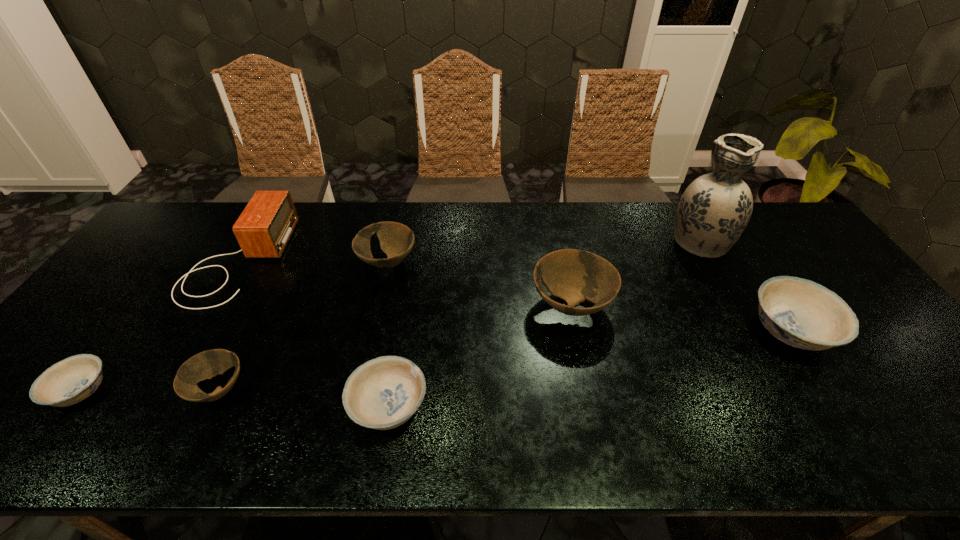
This screenshot has height=540, width=960. What are the coordinates of `the nearest brown bowl` in the screenshot? It's located at (207, 364).

I want to click on the shortest bowl, so click(x=74, y=379).

Where is `the leftmost bowl`? the leftmost bowl is located at coordinates (74, 379).

At what (x,y) coordinates should I click in order to perform the action: click on free spot located with the handle on the side of the blue vase. Please return your answer as a coordinate pair (x, y). Looking at the image, I should click on (679, 204).

Find the location of `free point located 0.310m on the front-facing side of the radio receiver`. free point located 0.310m on the front-facing side of the radio receiver is located at coordinates (382, 260).

Identify the location of vacant space located on the front of the biggest brown bowl. (594, 422).

Locate an element on the screen. vacant region located 0.140m on the left of the second brown bowl from left to right is located at coordinates (312, 263).

Where is `free location located 0.350m on the left of the biggest blue bowl`? The width and height of the screenshot is (960, 540). free location located 0.350m on the left of the biggest blue bowl is located at coordinates (613, 330).

The height and width of the screenshot is (540, 960). I want to click on free space located 0.280m on the left of the second blue bowl from left to right, so click(x=225, y=407).

The image size is (960, 540). I want to click on vacant space located 0.340m on the left of the nearest brown bowl, so click(x=43, y=389).